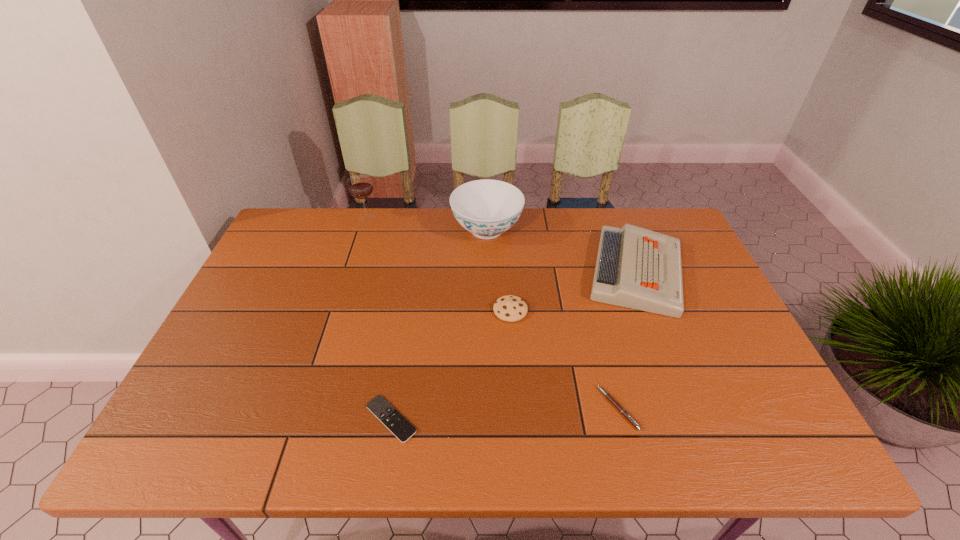
The image size is (960, 540). Identify the location of free space located 0.390m on the left of the computer keyboard. (454, 272).

Where is `vacant region located on the front of the third shortest object`? This screenshot has width=960, height=540. vacant region located on the front of the third shortest object is located at coordinates (519, 441).

Image resolution: width=960 pixels, height=540 pixels. Identify the location of vacant region located at the nib of the second shortest object. (482, 408).

At what (x,y) coordinates should I click in order to perform the action: click on vacant space situated 0.370m at the nib of the second shortest object. Please return your answer as a coordinate pair (x, y). The height and width of the screenshot is (540, 960). Looking at the image, I should click on (438, 408).

Locate an element on the screen. vacant space located at the nib of the second shortest object is located at coordinates (531, 408).

What are the coordinates of `vacant space situated 0.210m on the right of the remote control` in the screenshot? It's located at coord(513,419).

Where is `wineglass that is at the far edge`? wineglass that is at the far edge is located at coordinates click(x=360, y=186).

The image size is (960, 540). I want to click on chinaware that is at the far edge, so click(x=486, y=208).

Where is `computer keyboard present at the far edge`? computer keyboard present at the far edge is located at coordinates (637, 268).

Locate an element on the screen. The height and width of the screenshot is (540, 960). pen located in the near edge section of the desktop is located at coordinates (607, 395).